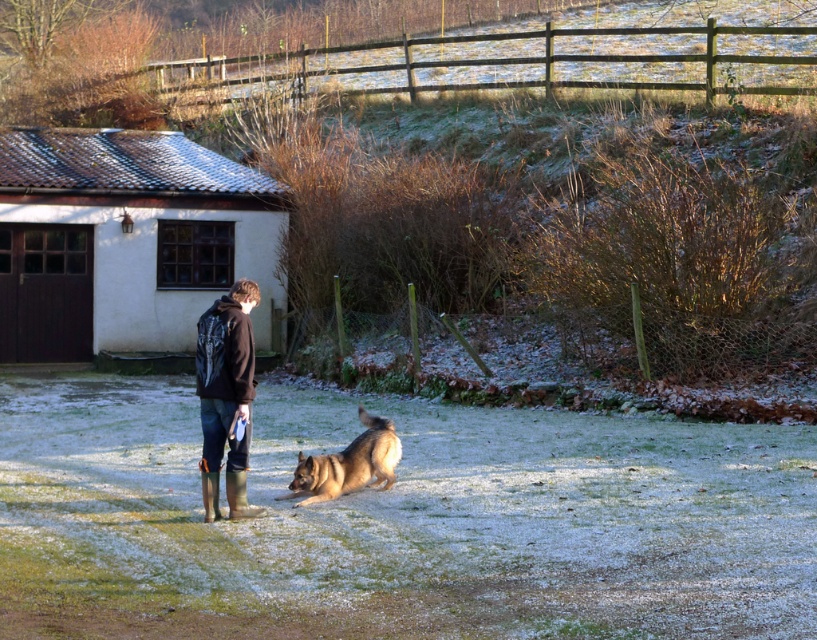
From the picture: You are standing in the rural scene and want to take a photo. There are two points marked in the image. Which point is closer to your camera, point 1 at coordinates (231, 403) or point 2 at (360, 442)?

Point 1 at coordinates (231, 403) is closer to the camera than point 2 at (360, 442).